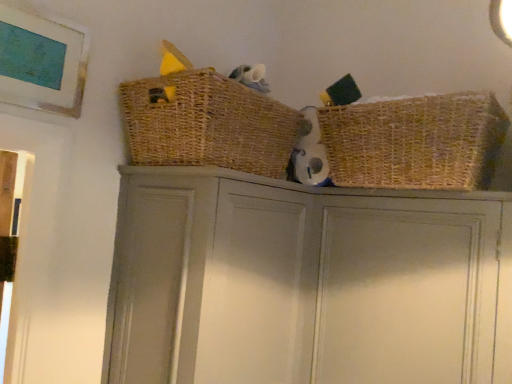
Question: From the image's perspective, is woven straw basket at upper right, the first basket in the right-to-left sequence, beneath woven brown basket at upper center, marked as the 1th basket in a left-to-right arrangement?

Choices:
 (A) yes
 (B) no

Answer: (A)

Question: Is woven straw basket at upper right, the first basket in the right-to-left sequence, bigger than woven brown basket at upper center, the 2th basket when ordered from right to left?

Choices:
 (A) yes
 (B) no

Answer: (B)

Question: Is woven straw basket at upper right, the first basket in the right-to-left sequence, far away from woven brown basket at upper center, marked as the 1th basket in a left-to-right arrangement?

Choices:
 (A) yes
 (B) no

Answer: (B)

Question: Is woven straw basket at upper right, the first basket in the right-to-left sequence, taller than woven brown basket at upper center, the 2th basket when ordered from right to left?

Choices:
 (A) yes
 (B) no

Answer: (A)

Question: From a real-world perspective, is woven straw basket at upper right, the first basket in the right-to-left sequence, physically below woven brown basket at upper center, marked as the 1th basket in a left-to-right arrangement?

Choices:
 (A) no
 (B) yes

Answer: (B)

Question: From the image's perspective, relative to woven brown basket at upper center, the 2th basket when ordered from right to left, is matte gray cabinet door at upper center above or below?

Choices:
 (A) below
 (B) above

Answer: (A)

Question: Considering the positions of point (454, 350) and point (186, 158), is point (454, 350) closer or farther from the camera than point (186, 158)?

Choices:
 (A) farther
 (B) closer

Answer: (A)

Question: Is matte gray cabinet door at upper center situated inside woven brown basket at upper center, marked as the 1th basket in a left-to-right arrangement, or outside?

Choices:
 (A) outside
 (B) inside

Answer: (A)

Question: From a real-world perspective, relative to woven brown basket at upper center, marked as the 1th basket in a left-to-right arrangement, is matte gray cabinet door at upper center vertically above or below?

Choices:
 (A) above
 (B) below

Answer: (B)

Question: Is matte gray cupboard at center to the left or to the right of woven straw basket at upper right, acting as the 2th basket starting from the left, in the image?

Choices:
 (A) right
 (B) left

Answer: (B)

Question: From their relative heights in the image, would you say matte gray cupboard at center is taller or shorter than woven straw basket at upper right, the first basket in the right-to-left sequence?

Choices:
 (A) short
 (B) tall

Answer: (B)

Question: Considering the positions of point (152, 198) and point (350, 132), is point (152, 198) closer or farther from the camera than point (350, 132)?

Choices:
 (A) farther
 (B) closer

Answer: (B)

Question: Relative to woven straw basket at upper right, acting as the 2th basket starting from the left, is matte gray cupboard at center in front or behind?

Choices:
 (A) front
 (B) behind

Answer: (A)

Question: Looking at their shapes, would you say woven brown basket at upper center, the 2th basket when ordered from right to left, is wider or thinner than woven straw basket at upper right, the first basket in the right-to-left sequence?

Choices:
 (A) thin
 (B) wide

Answer: (B)

Question: Relative to woven straw basket at upper right, acting as the 2th basket starting from the left, is woven brown basket at upper center, the 2th basket when ordered from right to left, in front or behind?

Choices:
 (A) front
 (B) behind

Answer: (A)